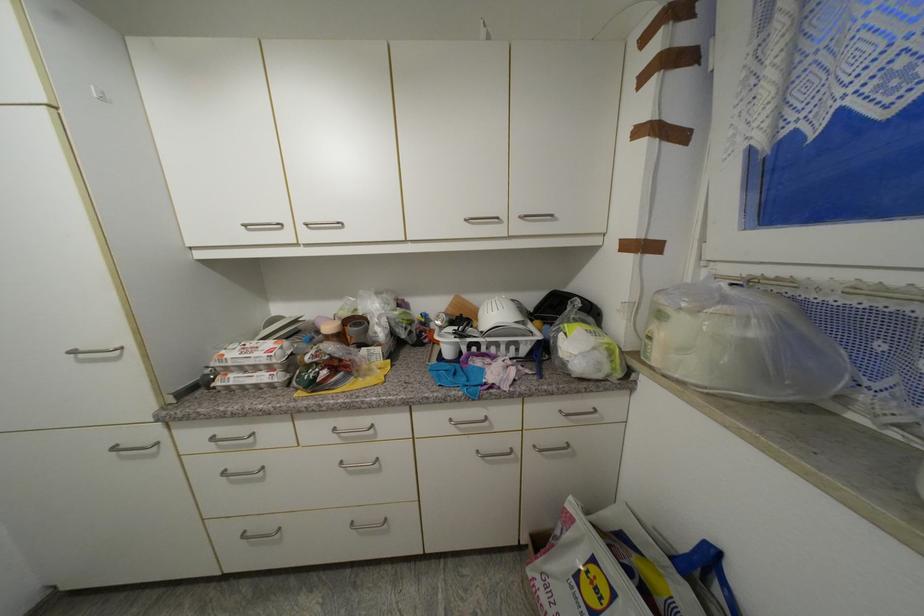
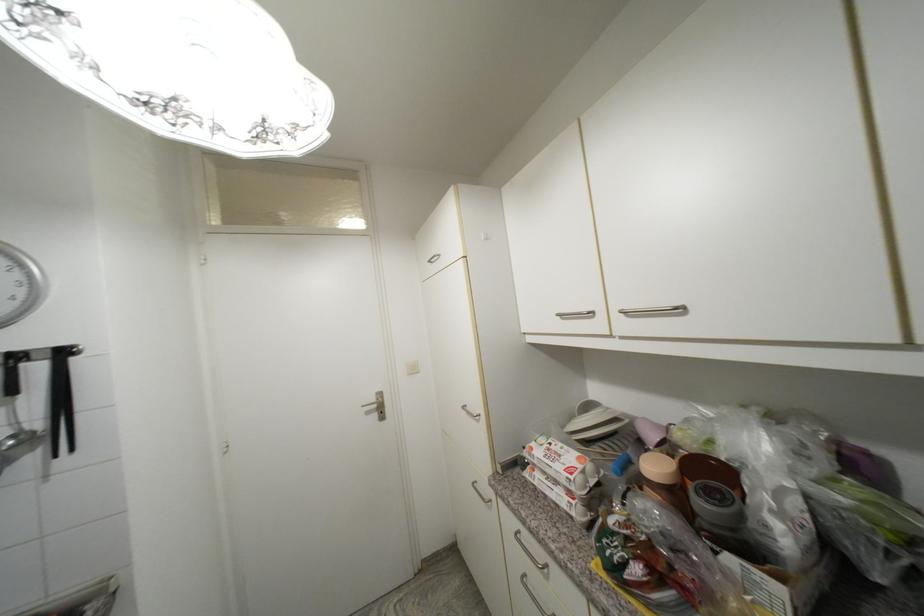
Find the pixel in the second image that matches [237,384] in the first image.

(541, 485)